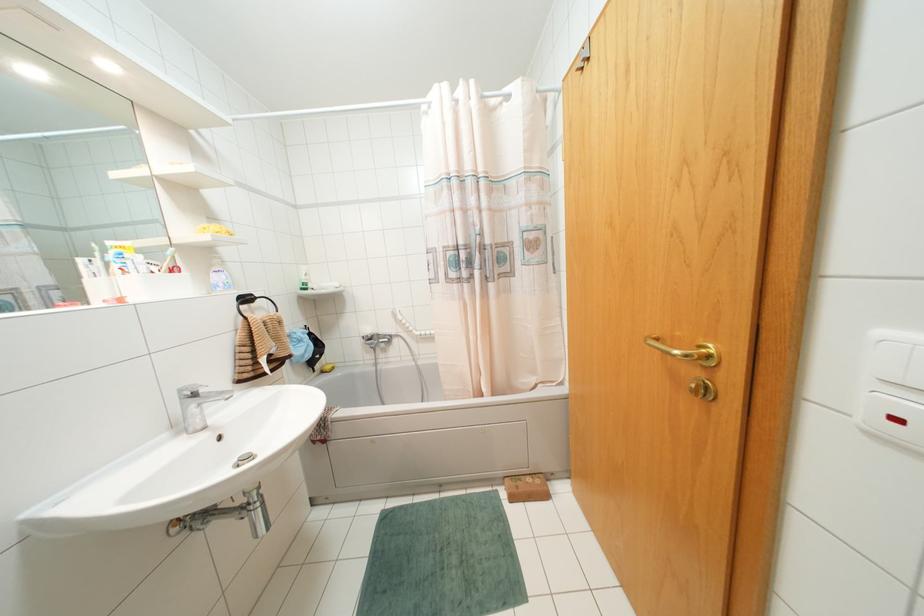
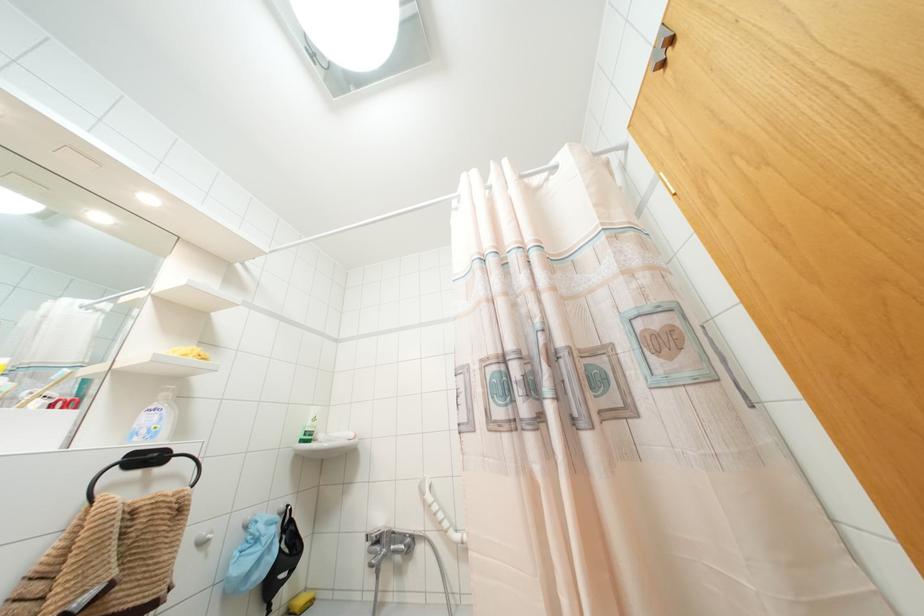
In the second image, find the point that corresponds to [245,299] in the first image.

(147, 458)